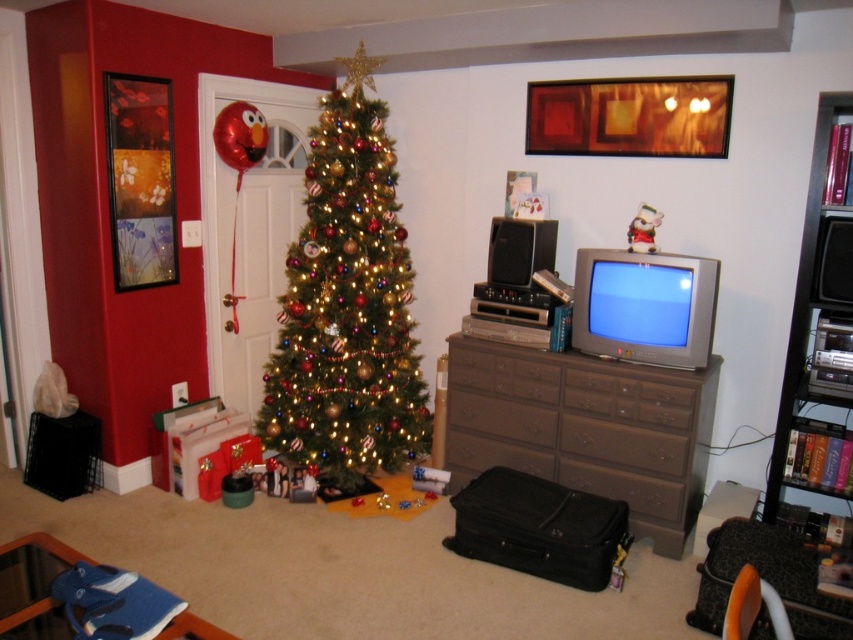
Question: Which point is closer to the camera taking this photo?

Choices:
 (A) (560, 460)
 (B) (343, 486)

Answer: (A)

Question: Does shiny gold christmas tree at center have a smaller size compared to white glossy santa at upper center?

Choices:
 (A) no
 (B) yes

Answer: (A)

Question: Can you confirm if shiny gold christmas tree at center is positioned to the left of brown matte dresser at center?

Choices:
 (A) no
 (B) yes

Answer: (B)

Question: Which is farther from the white glossy santa at upper center?

Choices:
 (A) brown matte dresser at center
 (B) shiny gold christmas tree at center

Answer: (B)

Question: Which point is closer to the camera?

Choices:
 (A) (343, 227)
 (B) (630, 250)

Answer: (B)

Question: Does shiny gold christmas tree at center appear under brown matte dresser at center?

Choices:
 (A) no
 (B) yes

Answer: (A)